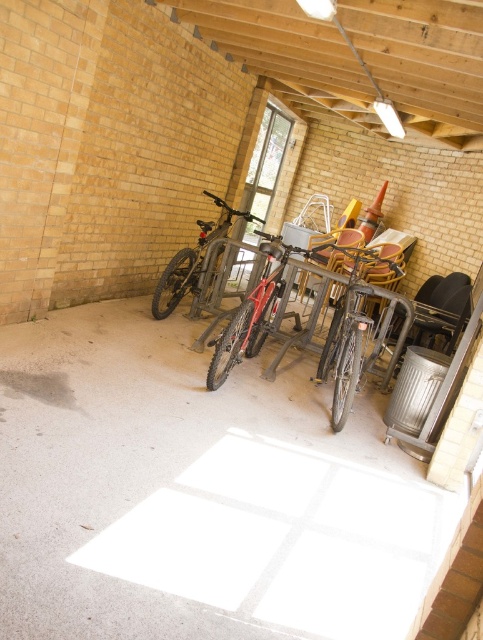
You are a delivery person who just arrived at the bike storage area. You need to park your bike between the shiny metallic bicycle at center and the shiny silver bicycle at center. Is there enough space between them to fit your bike?

The shiny metallic bicycle at center is larger in size than the shiny silver bicycle at center, but the exact distance between them isn not provided. Without knowing the space between them, it is impossible to determine if your bike will fit.

You are a maintenance worker who needs to move the shiny silver bicycle at center to a different location. The equipment on the white concrete floor at center is currently in use. Can you safely move the bicycle without disturbing the equipment?

The distance between the white concrete floor at center and the shiny silver bicycle at center is 1.98 meters. Since the equipment is placed on the floor, moving the bicycle would require careful handling to ensure the 1.98 meters of space remains sufficient and the equipment remains undisturbed.